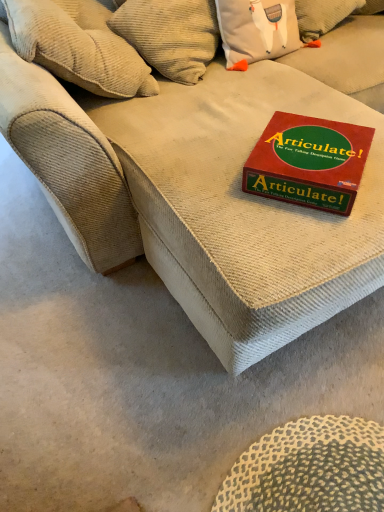
Question: Is beige corduroy couch at center far from red cardboard game box at center?

Choices:
 (A) no
 (B) yes

Answer: (A)

Question: Considering the relative positions of beige corduroy couch at center and red cardboard game box at center in the image provided, is beige corduroy couch at center in front of red cardboard game box at center?

Choices:
 (A) yes
 (B) no

Answer: (A)

Question: Does beige corduroy couch at center appear on the left side of red cardboard game box at center?

Choices:
 (A) no
 (B) yes

Answer: (A)

Question: Does beige corduroy couch at center have a lesser height compared to red cardboard game box at center?

Choices:
 (A) no
 (B) yes

Answer: (A)

Question: Is beige corduroy couch at center outside of red cardboard game box at center?

Choices:
 (A) no
 (B) yes

Answer: (B)

Question: From the image's perspective, is red cardboard game box at center above or below beige corduroy pillow at upper left?

Choices:
 (A) above
 (B) below

Answer: (B)

Question: Do you think red cardboard game box at center is within beige corduroy pillow at upper left, or outside of it?

Choices:
 (A) outside
 (B) inside

Answer: (A)

Question: Looking at the image, does red cardboard game box at center seem bigger or smaller compared to beige corduroy pillow at upper left?

Choices:
 (A) big
 (B) small

Answer: (B)

Question: Visually, is red cardboard game box at center positioned to the left or to the right of beige corduroy pillow at upper left?

Choices:
 (A) right
 (B) left

Answer: (A)

Question: From a real-world perspective, relative to red cardboard game box at center, is beige corduroy pillow at upper left vertically above or below?

Choices:
 (A) below
 (B) above

Answer: (B)

Question: Is beige corduroy pillow at upper left inside the boundaries of red cardboard game box at center, or outside?

Choices:
 (A) outside
 (B) inside

Answer: (A)

Question: From the image's perspective, is beige corduroy pillow at upper left above or below red cardboard game box at center?

Choices:
 (A) above
 (B) below

Answer: (A)

Question: Relative to red cardboard game box at center, is beige corduroy pillow at upper left in front or behind?

Choices:
 (A) behind
 (B) front

Answer: (A)

Question: Is point (283, 183) closer or farther from the camera than point (188, 251)?

Choices:
 (A) farther
 (B) closer

Answer: (B)

Question: In the image, is red cardboard game box at center positioned in front of or behind beige corduroy couch at center?

Choices:
 (A) behind
 (B) front

Answer: (A)